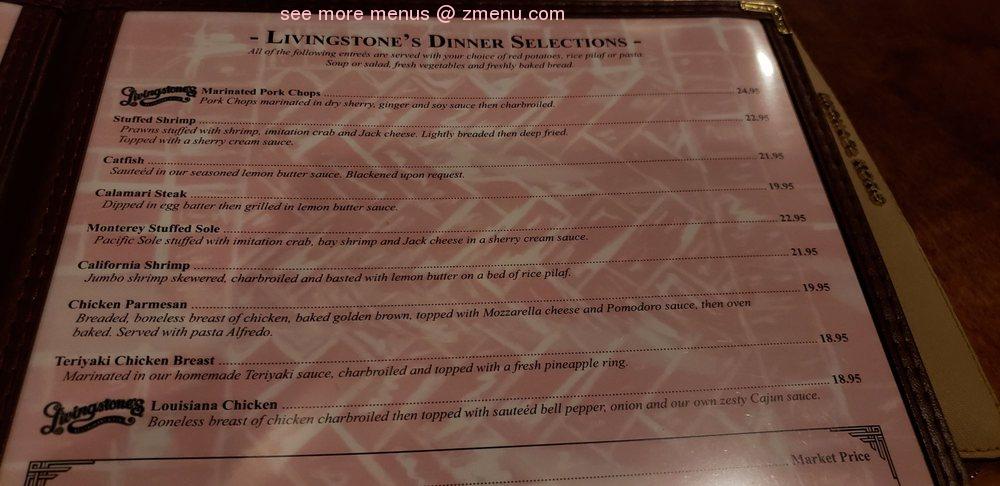
Where is `hinge or binding`? hinge or binding is located at coordinates (27, 115).